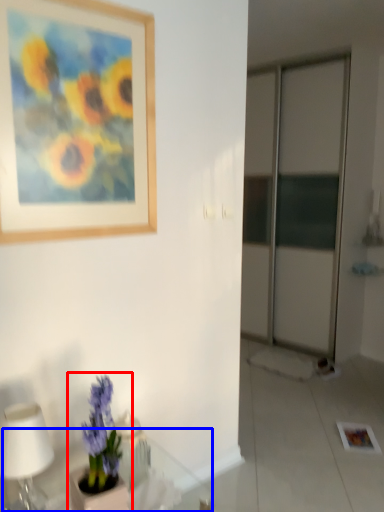
Question: Which object is closer to the camera taking this photo, houseplant (highlighted by a red box) or round table (highlighted by a blue box)?

Choices:
 (A) houseplant
 (B) round table

Answer: (B)